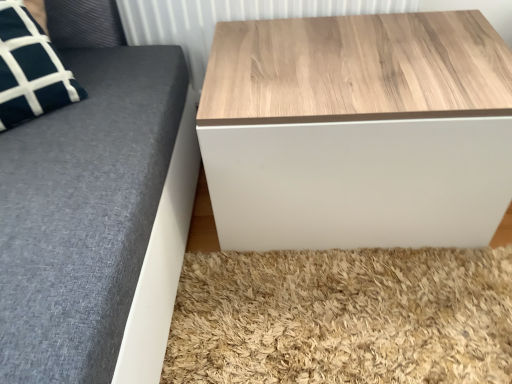
Question: Relative to wooden/textured table at upper right, is wooden panel at upper center in front or behind?

Choices:
 (A) front
 (B) behind

Answer: (B)

Question: From a real-world perspective, is wooden panel at upper center physically located above or below wooden/textured table at upper right?

Choices:
 (A) above
 (B) below

Answer: (A)

Question: Choose the correct answer: Is wooden panel at upper center inside wooden/textured table at upper right or outside it?

Choices:
 (A) inside
 (B) outside

Answer: (B)

Question: Visually, is wooden/textured table at upper right positioned to the left or to the right of wooden panel at upper center?

Choices:
 (A) left
 (B) right

Answer: (B)

Question: From their relative heights in the image, would you say wooden/textured table at upper right is taller or shorter than wooden panel at upper center?

Choices:
 (A) tall
 (B) short

Answer: (A)

Question: Relative to wooden panel at upper center, is wooden/textured table at upper right in front or behind?

Choices:
 (A) behind
 (B) front

Answer: (B)

Question: Considering the positions of wooden/textured table at upper right and wooden panel at upper center in the image, is wooden/textured table at upper right wider or thinner than wooden panel at upper center?

Choices:
 (A) thin
 (B) wide

Answer: (B)